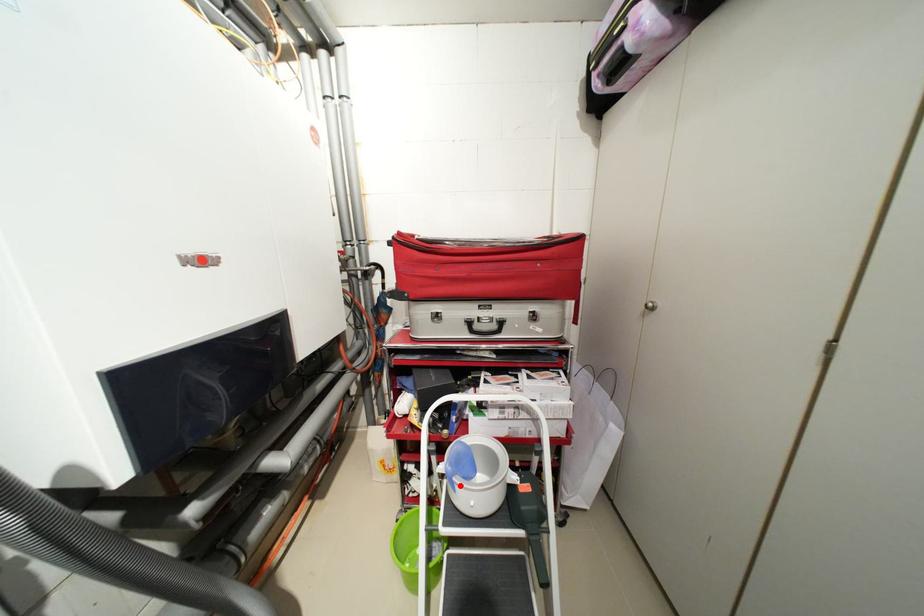
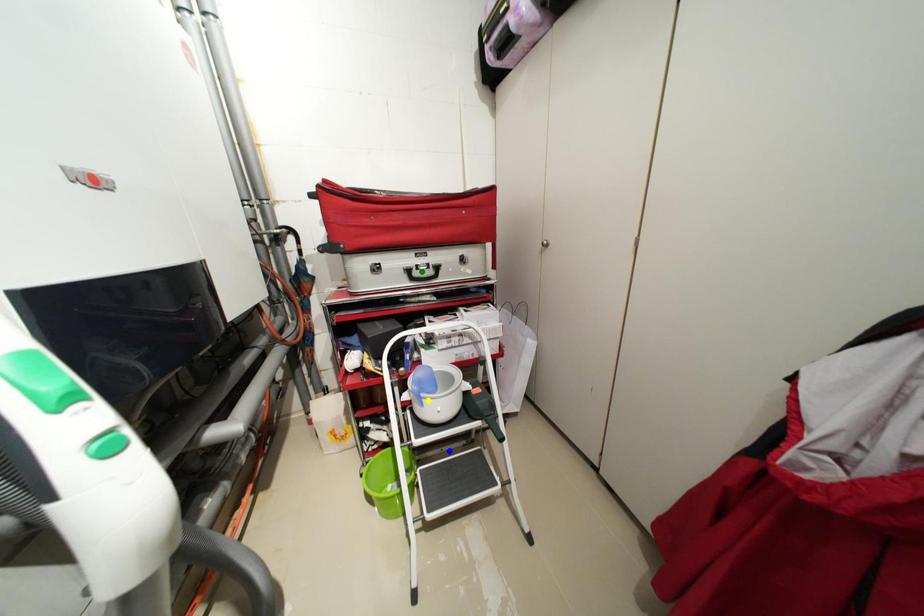
Question: I am providing you with two images of the same scene from different viewpoints. A red point is marked on the first image. You are given multiple points on the second image. Which mark in image 2 goes with the point in image 1?

Choices:
 (A) blue point
 (B) green point
 (C) yellow point

Answer: (C)